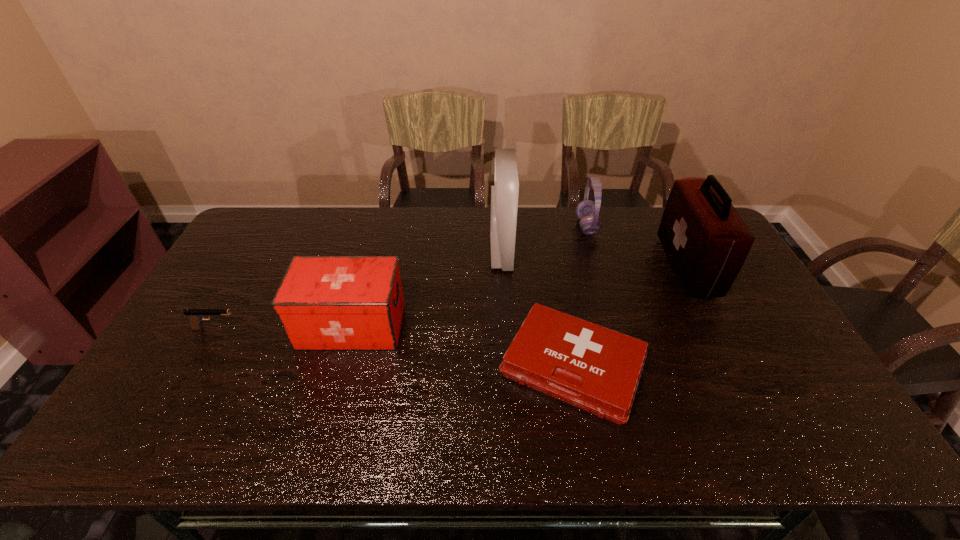
Find the location of a particular element. vacant space in between the shortest object and the third tallest first-aid kit is located at coordinates click(463, 346).

Where is `vacant space that's between the pistol and the rightmost object`? The image size is (960, 540). vacant space that's between the pistol and the rightmost object is located at coordinates (451, 297).

The height and width of the screenshot is (540, 960). In order to click on vacant space in between the leftmost first-aid kit and the headset in this screenshot , I will do `click(469, 276)`.

Select which object is the third closest to the shortest object. Please provide its 2D coordinates. Your answer should be formatted as a tuple, i.e. [(x, y)], where the tuple contains the x and y coordinates of a point satisfying the conditions above.

[(323, 302)]

This screenshot has width=960, height=540. What are the coordinates of `the second closest object to the headset` in the screenshot? It's located at (504, 194).

The image size is (960, 540). Find the location of `the first-aid kit that stands as the third closest to the shortest object`. the first-aid kit that stands as the third closest to the shortest object is located at coordinates (323, 302).

The image size is (960, 540). I want to click on the first-aid kit that can be found as the fourth closest to the leftmost object, so click(706, 241).

Locate an element on the screen. free space in the image that satisfies the following two spatial constraints: 1. on the handle side of the shortest object; 2. on the right side of the second shortest first-aid kit is located at coordinates (341, 366).

I want to click on vacant point that satisfies the following two spatial constraints: 1. at the muzzle of the second shortest object; 2. on the right side of the shortest first-aid kit, so click(x=194, y=366).